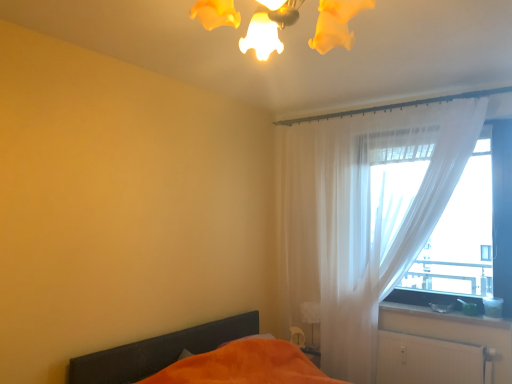
This screenshot has height=384, width=512. What are the coordinates of `empty space that is ontop of smooth white surface at lower right (from a real-world perspective)` in the screenshot? It's located at [x=440, y=309].